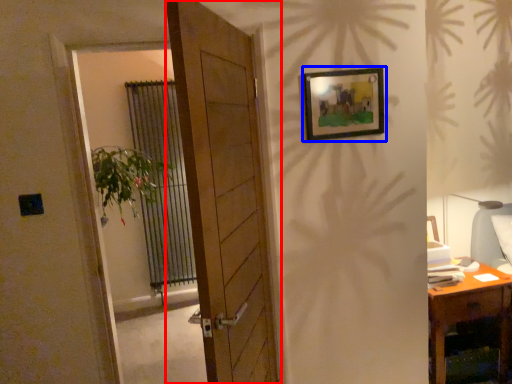
Question: Among these objects, which one is farthest to the camera, door (highlighted by a red box) or picture frame (highlighted by a blue box)?

Choices:
 (A) door
 (B) picture frame

Answer: (B)